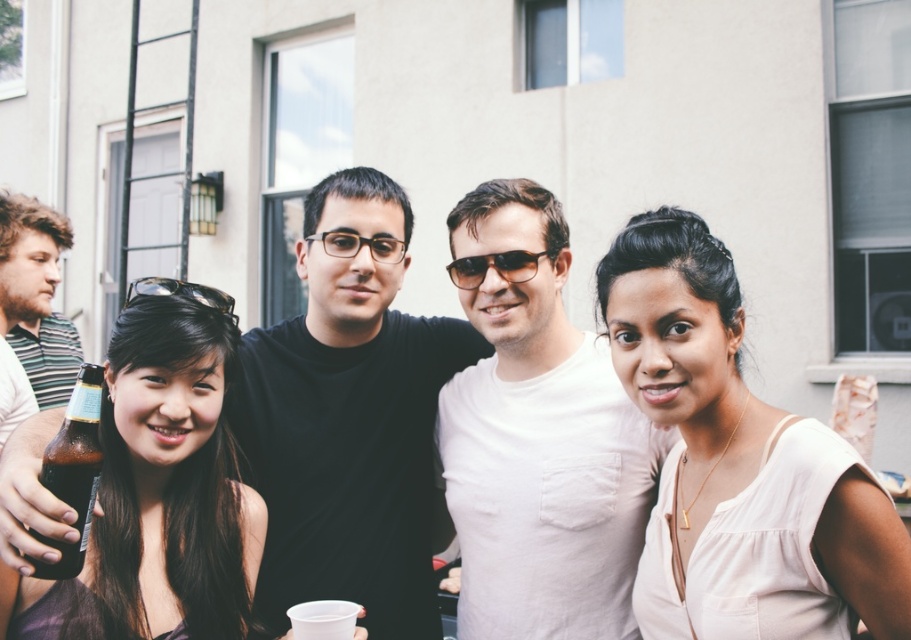
Question: Which point is closer to the camera taking this photo?

Choices:
 (A) (131, 612)
 (B) (200, 296)
 (C) (75, 461)
 (D) (469, 256)

Answer: (C)

Question: Which of these objects is positioned farthest from the striped cotton shirt at left?

Choices:
 (A) black plastic sunglasses at center
 (B) brown matte bottle at left
 (C) black plastic goggles at upper left

Answer: (A)

Question: Can you confirm if black plastic sunglasses at center is bigger than black plastic goggles at upper left?

Choices:
 (A) no
 (B) yes

Answer: (A)

Question: From the image, what is the correct spatial relationship of brown matte bottle at left in relation to striped cotton shirt at left?

Choices:
 (A) right
 (B) left

Answer: (A)

Question: Which is farther from the brown glass bottle at lower left?

Choices:
 (A) pale pink fabric at center
 (B) brown matte bottle at left
 (C) black plastic goggles at upper left
 (D) black plastic sunglasses at center

Answer: (A)

Question: From the image, what is the correct spatial relationship of pale pink fabric at center in relation to brown glass bottle at lower left?

Choices:
 (A) below
 (B) above

Answer: (B)